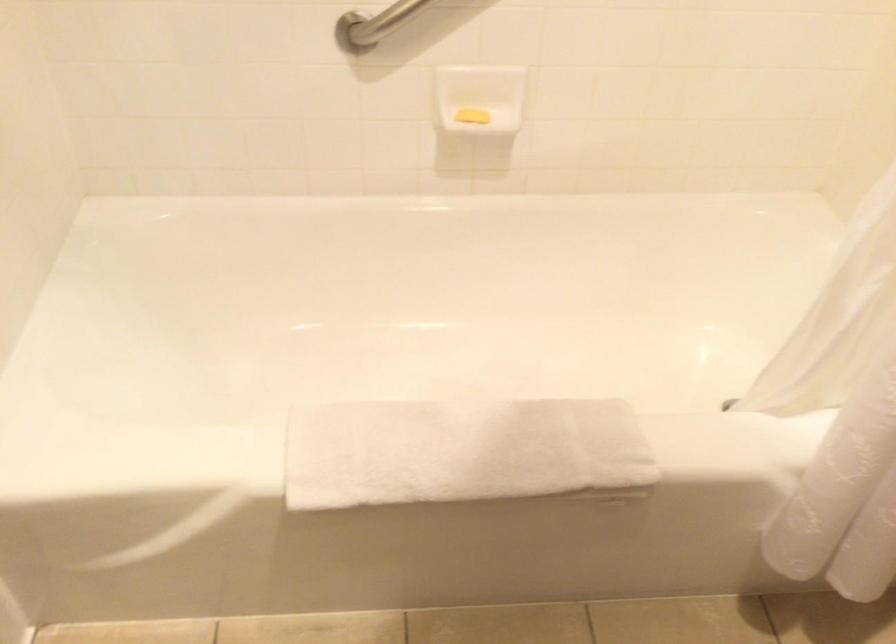
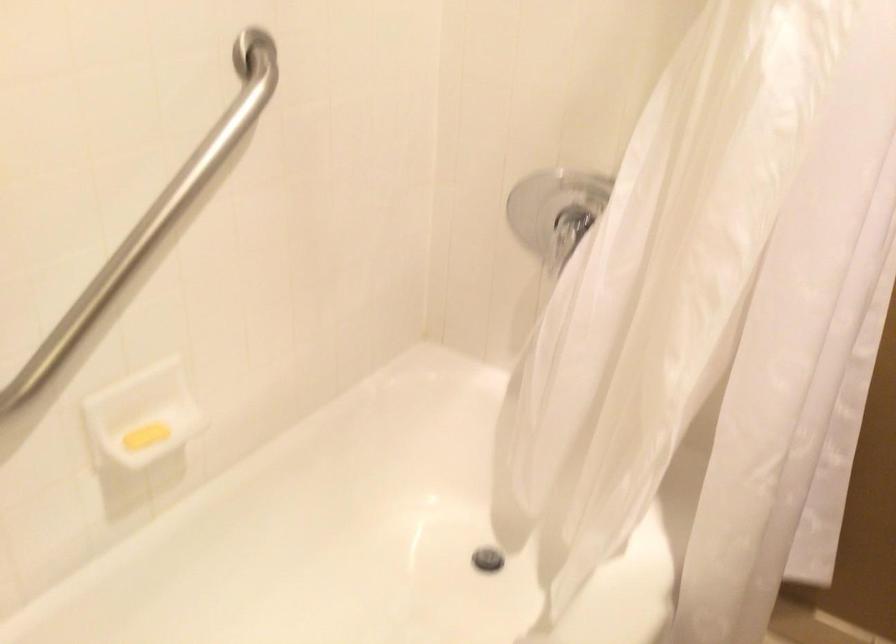
Where in the second image is the point corresponding to point (468, 114) from the first image?

(145, 436)